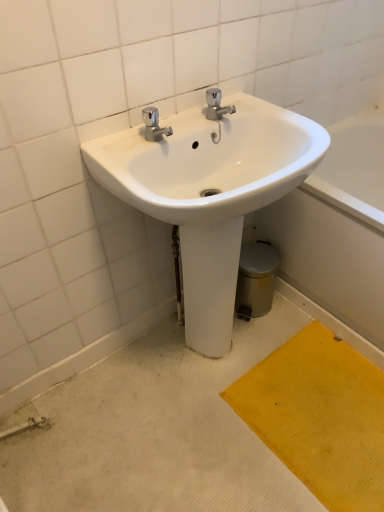
Identify the location of free space to the left of white glossy sink at center. The width and height of the screenshot is (384, 512). (88, 411).